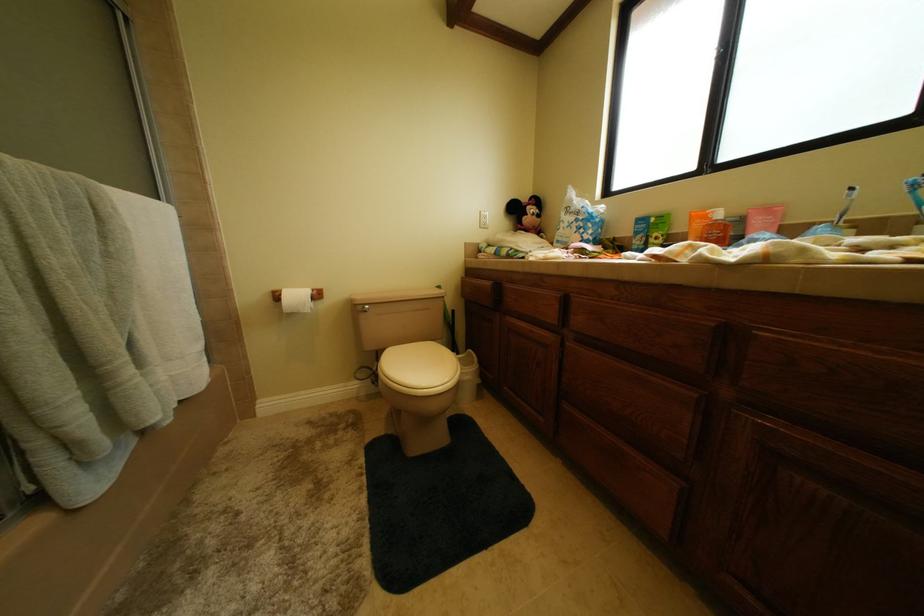
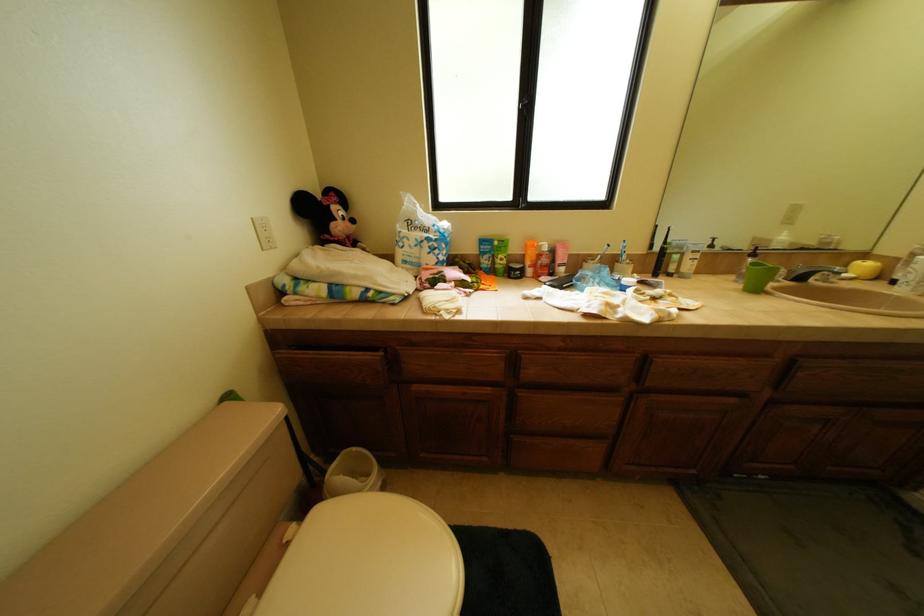
The first image is from the beginning of the video and the second image is from the end. How did the camera likely rotate when shooting the video?

The camera's rotation is toward right-down.